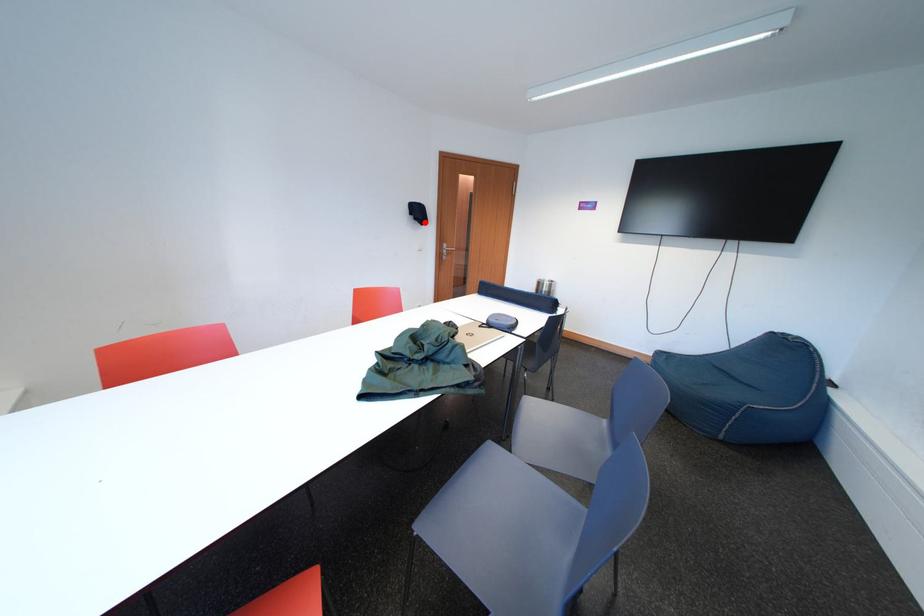
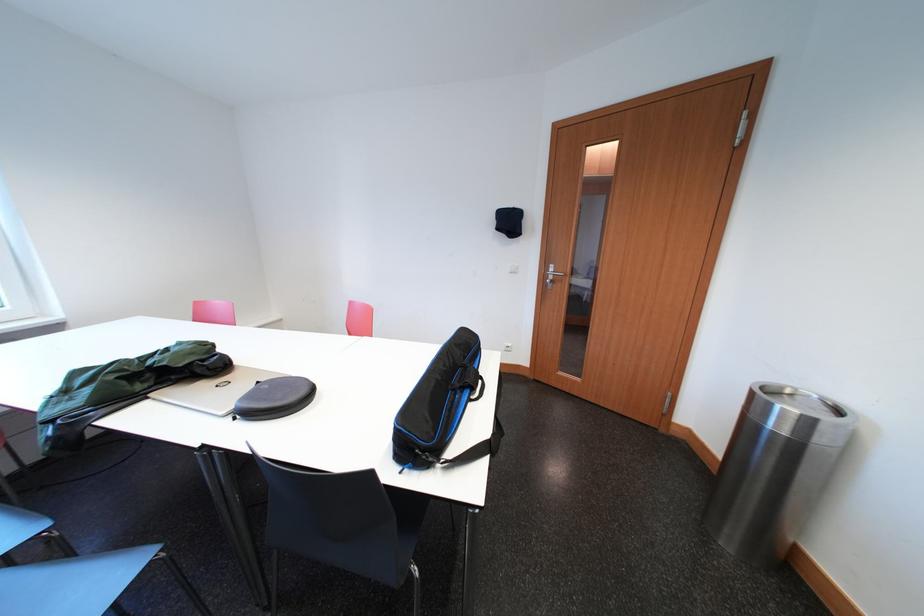
In the second image, find the point that corresponds to the highlighted location in the first image.

(506, 233)